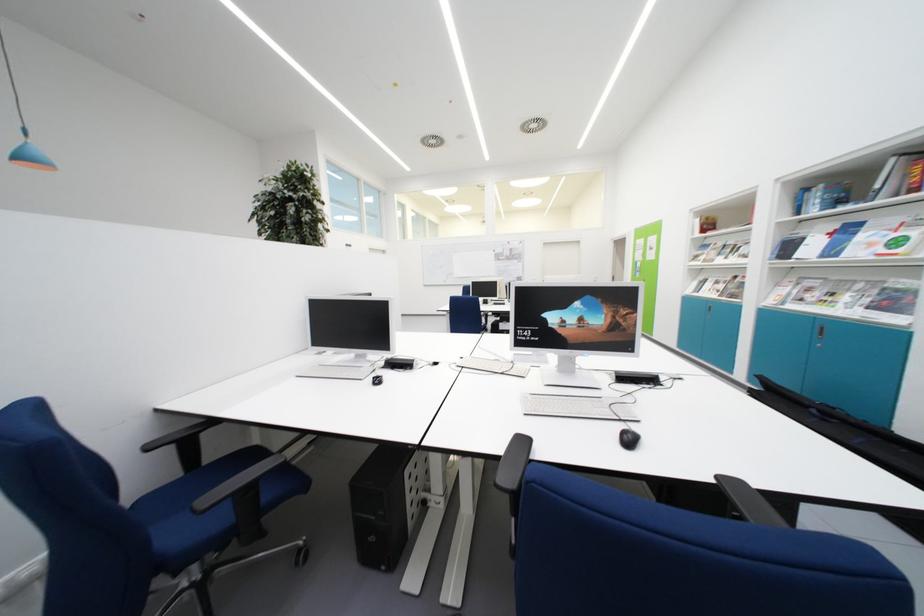
Find the location of a particular element. Image resolution: width=924 pixels, height=616 pixels. silver laptop is located at coordinates (350, 323).